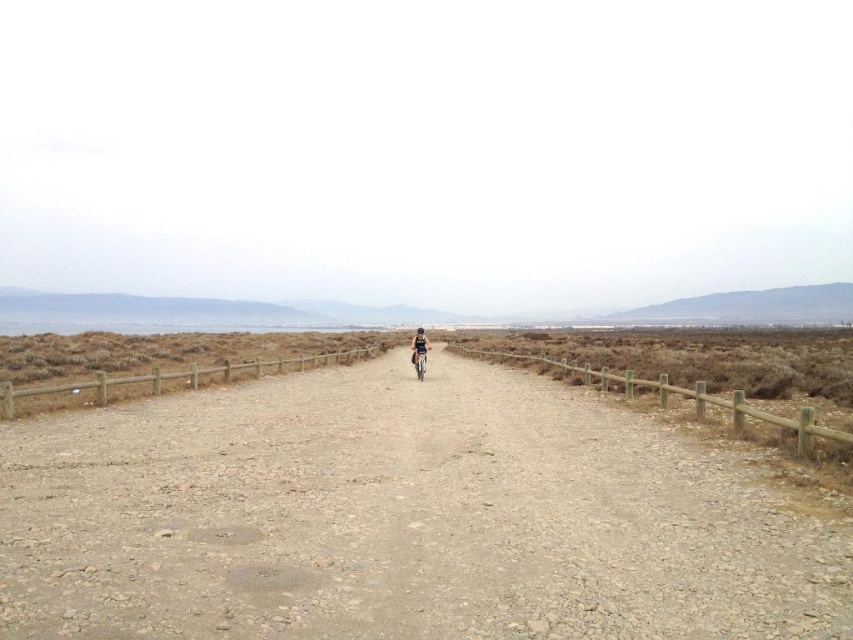
You are standing at the starting point of the dirt path and want to reach the wooden fence at right. Which direction should you move relative to the denim shorts at center?

You should move to the right relative to the denim shorts at center to reach the wooden fence at right since the wooden fence at right is located to the right of the denim shorts at center.

You are standing on the path and notice the dull brown dirt track at center and denim shorts at center. Which object is closer to your feet?

The dull brown dirt track at center is closer to your feet since it is located below the denim shorts at center.